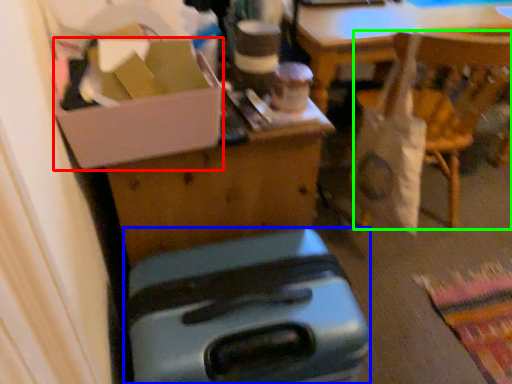
Question: Which object is positioned farthest from box (highlighted by a red box)? Select from luggage (highlighted by a blue box) and chair (highlighted by a green box).

Choices:
 (A) luggage
 (B) chair

Answer: (B)